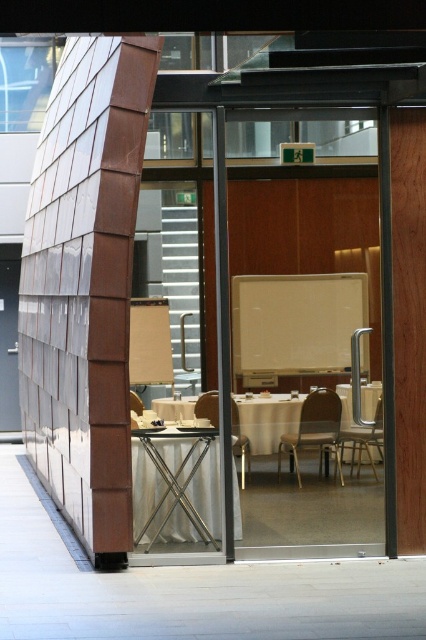
Can you confirm if white fabric table at center is positioned to the right of metallic silver chair at center?

Incorrect, white fabric table at center is not on the right side of metallic silver chair at center.

Does white fabric table at center appear over metallic silver chair at center?

Yes, white fabric table at center is above metallic silver chair at center.

Between point (270, 452) and point (304, 417), which one is positioned in front?

Point (304, 417)

Where is `white fabric table at center`? This screenshot has height=640, width=426. white fabric table at center is located at coordinates (267, 419).

This screenshot has width=426, height=640. Describe the element at coordinates (314, 429) in the screenshot. I see `metallic silver chair at center` at that location.

Who is shorter, metallic silver chair at center or matte brown chair at center?

Standing shorter between the two is matte brown chair at center.

Between point (308, 397) and point (235, 413), which one is positioned behind?

The point (235, 413) is more distant.

You are a GUI agent. You are given a task and a screenshot of the screen. Output one action in this format:
    pyautogui.click(x=<x>, y=<y>)
    Task: Click on the metallic silver chair at center
    
    Given the screenshot: What is the action you would take?
    pyautogui.click(x=314, y=429)

Is white fabric table at center positioned in front of metallic gold chair at center-right?

No.

Does white fabric table at center have a greater width compared to metallic gold chair at center-right?

Correct, the width of white fabric table at center exceeds that of metallic gold chair at center-right.

Which is in front, point (264, 404) or point (382, 449)?

Positioned in front is point (264, 404).

Locate an element on the screen. white fabric table at center is located at coordinates (267, 419).